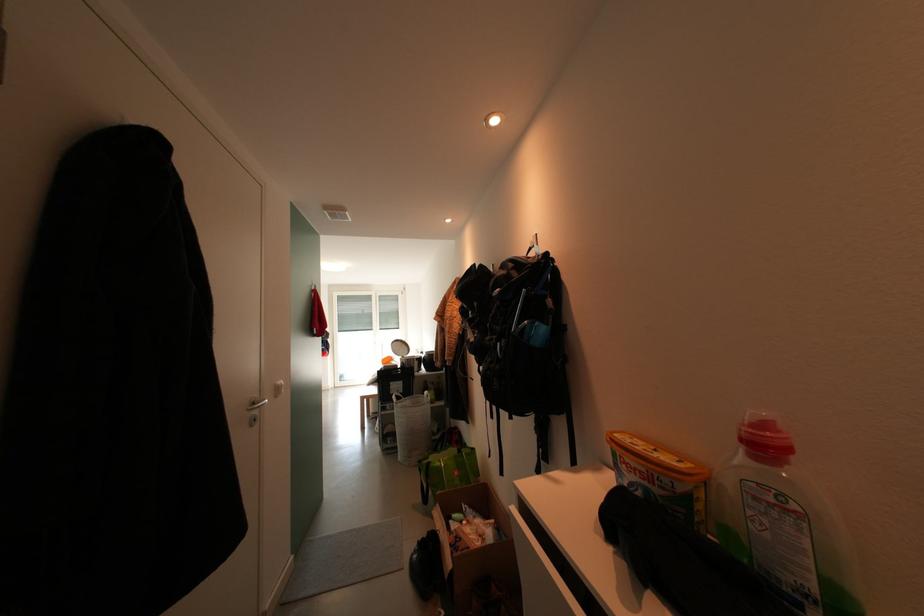
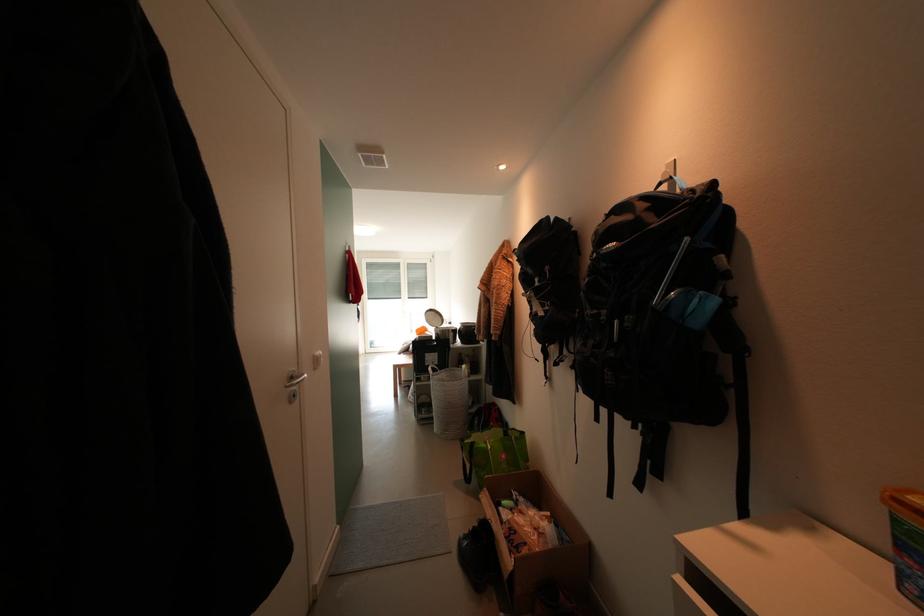
Which direction would the cameraman need to move to produce the second image?

The cameraman moved toward left, forward.